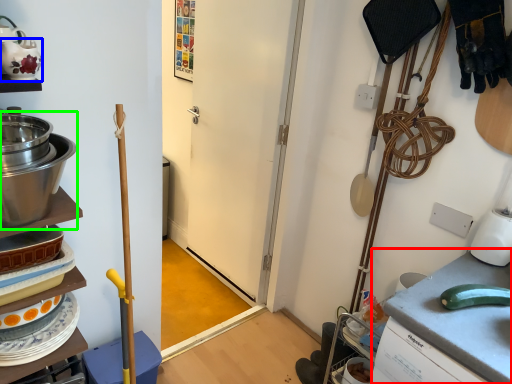
Question: Which is farther away from counter top (highlighted by a red box)? tea pot (highlighted by a blue box) or appliance (highlighted by a green box)?

Choices:
 (A) tea pot
 (B) appliance

Answer: (A)